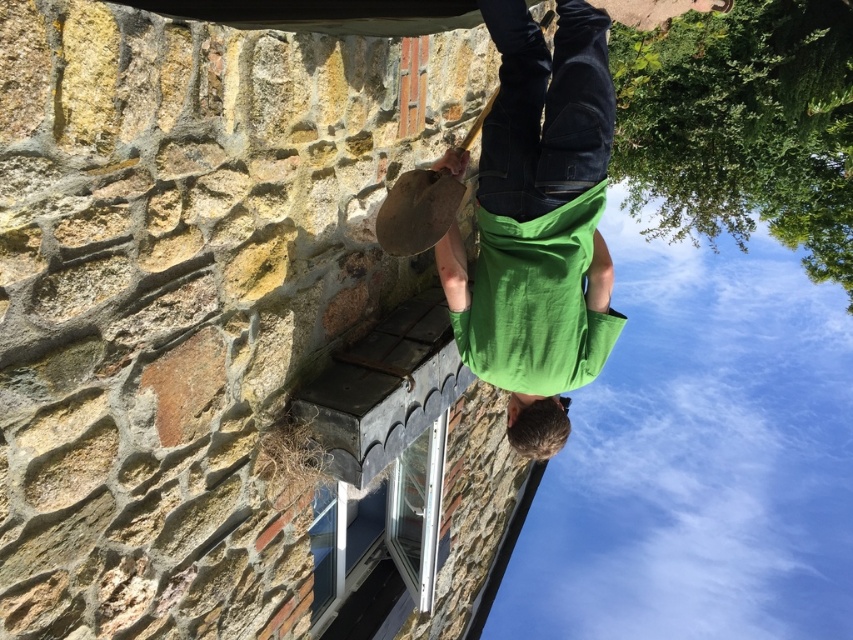
You are standing in front of the stone wall and want to place a small sticker on the point that is closer to you. Which point should you choose between the point at coordinates (498, 374) and the point at coordinates (399, 598)?

You should choose the point at coordinates (498, 374) because it is closer to the viewer than the point at coordinates (399, 598).

You are a delivery person trying to place a package on the ground near the white plastic window at lower center. Is the green matte skateboard at center blocking your access to that area?

The green matte skateboard at center is above the white plastic window at lower center, so it is not blocking the area near the window. You can place the package there without any issue.